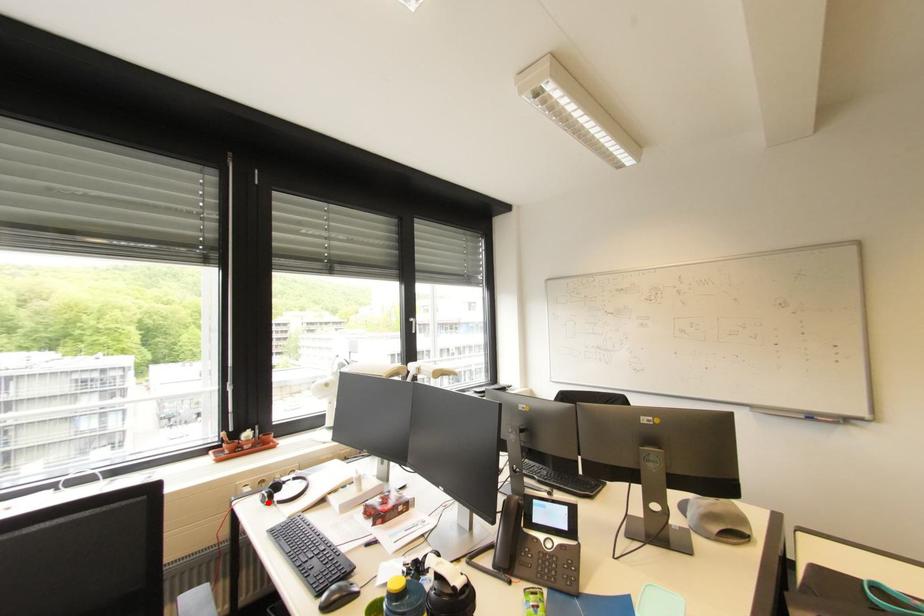
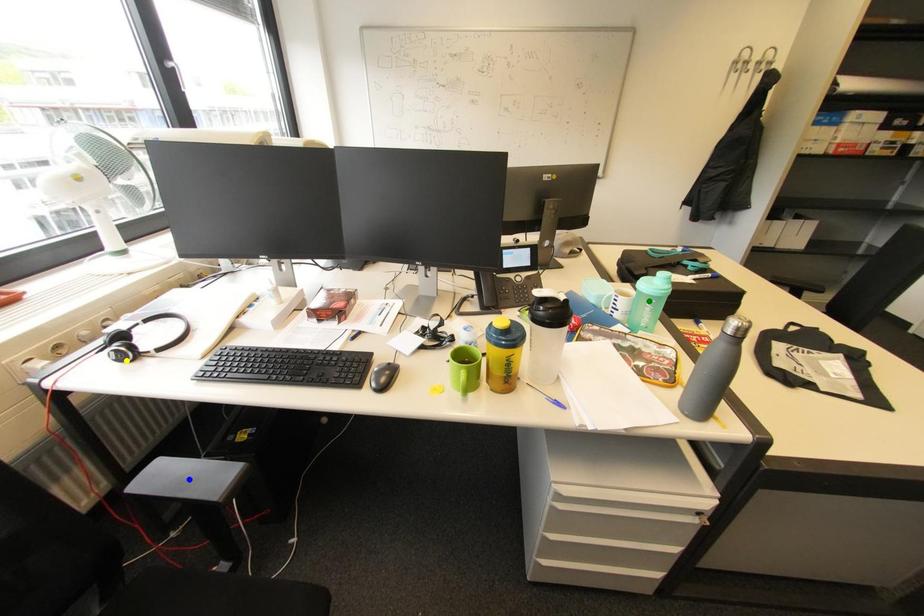
Question: I am providing you with two images of the same scene from different viewpoints. A red point is marked on the first image. You are given multiple points on the second image. Which spot in image 2 lines up with the point in image 1?

Choices:
 (A) green point
 (B) blue point
 (C) yellow point

Answer: (C)